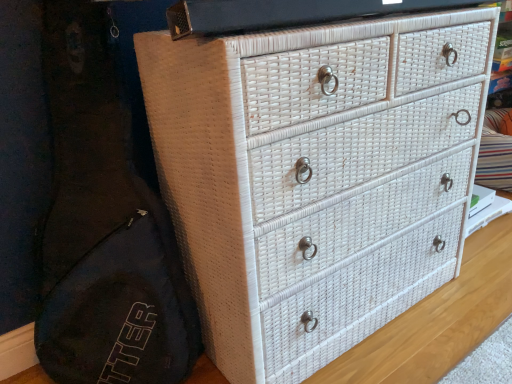
I want to click on white wicker chest of drawers at center, so click(316, 176).

The image size is (512, 384). Describe the element at coordinates (316, 176) in the screenshot. I see `white wicker chest of drawers at center` at that location.

At what (x,y) coordinates should I click in order to perform the action: click on white wicker chest of drawers at center. Please return your answer as a coordinate pair (x, y). The width and height of the screenshot is (512, 384). Looking at the image, I should click on (316, 176).